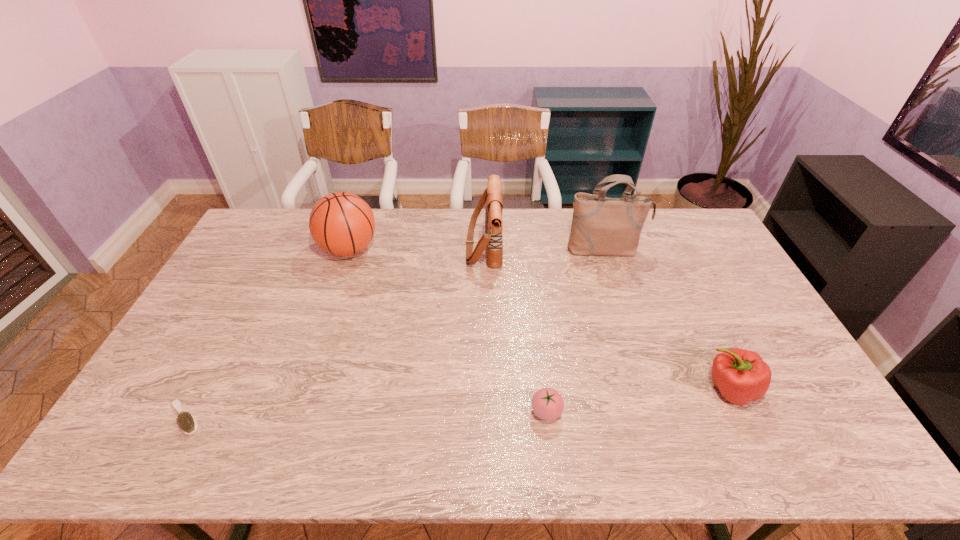
Where is `the taller shoulder bag`? The height and width of the screenshot is (540, 960). the taller shoulder bag is located at coordinates (604, 226).

The image size is (960, 540). In order to click on the second object from right to left in this screenshot , I will do `click(604, 226)`.

At what (x,y) coordinates should I click in order to perform the action: click on the second object from left to right. Please return your answer as a coordinate pair (x, y). Image resolution: width=960 pixels, height=540 pixels. Looking at the image, I should click on (341, 223).

Locate an element on the screen. the third object from left to right is located at coordinates (492, 240).

The width and height of the screenshot is (960, 540). Find the location of `the shorter shoulder bag`. the shorter shoulder bag is located at coordinates 492,240.

Where is `the rightmost object`? the rightmost object is located at coordinates (741, 376).

In order to click on bell pepper in this screenshot , I will do `click(741, 376)`.

Locate an element on the screen. Image resolution: width=960 pixels, height=540 pixels. the second shortest object is located at coordinates (547, 404).

The image size is (960, 540). Find the location of `tomato`. tomato is located at coordinates (547, 404).

Find the location of `the shortest object`. the shortest object is located at coordinates (187, 423).